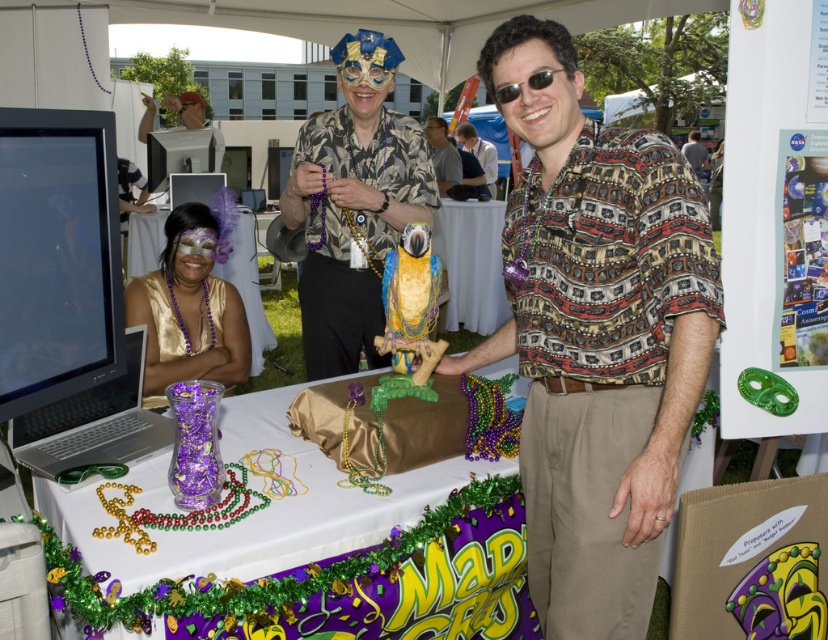
Does printed cotton shirt at center have a smaller size compared to purple satin mask at center?

Actually, printed cotton shirt at center might be larger than purple satin mask at center.

Which is in front, point (521, 259) or point (145, 292)?

Point (521, 259)

Which is behind, point (697, 394) or point (188, 358)?

Point (188, 358)

Image resolution: width=828 pixels, height=640 pixels. Find the location of `printed cotton shirt at center`. printed cotton shirt at center is located at coordinates (595, 337).

Between patterned shirt at center and matte black mask at upper center, which one is positioned higher?

matte black mask at upper center is above.

Which of these two, patterned shirt at center or matte black mask at upper center, stands taller?

With more height is matte black mask at upper center.

The width and height of the screenshot is (828, 640). In order to click on patterned shirt at center in this screenshot , I will do `click(441, 154)`.

The height and width of the screenshot is (640, 828). Find the location of `patterned shirt at center`. patterned shirt at center is located at coordinates (441, 154).

Who is taller, matte black mask at upper left or matte gold shirt at center?

Standing taller between the two is matte gold shirt at center.

The height and width of the screenshot is (640, 828). What do you see at coordinates (186, 108) in the screenshot? I see `matte black mask at upper left` at bounding box center [186, 108].

Locate an element on the screen. The width and height of the screenshot is (828, 640). matte black mask at upper left is located at coordinates (186, 108).